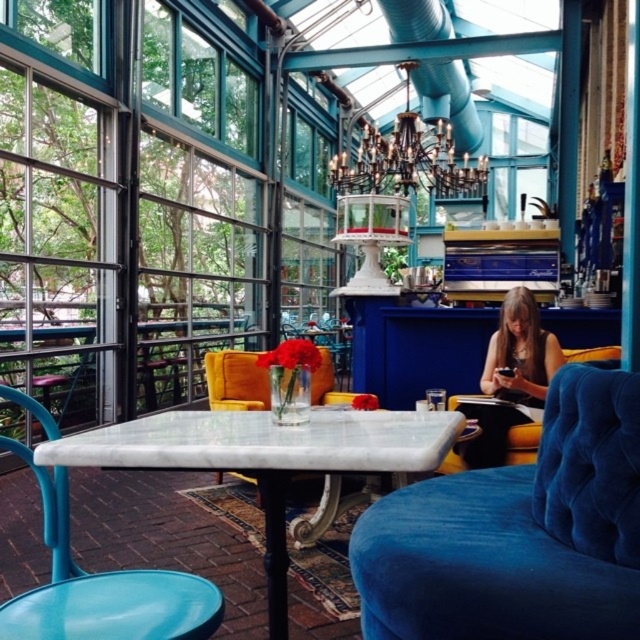
Question: Estimate the real-world distances between objects in this image. Which object is closer to the velvet blue armchair at right?

Choices:
 (A) velvet yellow armchair at center
 (B) velvet blue armchair at center

Answer: (B)

Question: Is smooth brown hair at right to the right of velvet blue armchair at center from the viewer's perspective?

Choices:
 (A) yes
 (B) no

Answer: (B)

Question: Is matte blue armchair at center smaller than velvet yellow armchair at center?

Choices:
 (A) no
 (B) yes

Answer: (A)

Question: Which object is the farthest from the matte blue armchair at center?

Choices:
 (A) velvet blue armchair at right
 (B) white marble table at center

Answer: (A)

Question: Among these objects, which one is nearest to the camera?

Choices:
 (A) white marble table at center
 (B) velvet blue armchair at right

Answer: (B)

Question: Is velvet blue armchair at right smaller than velvet blue armchair at center?

Choices:
 (A) no
 (B) yes

Answer: (A)